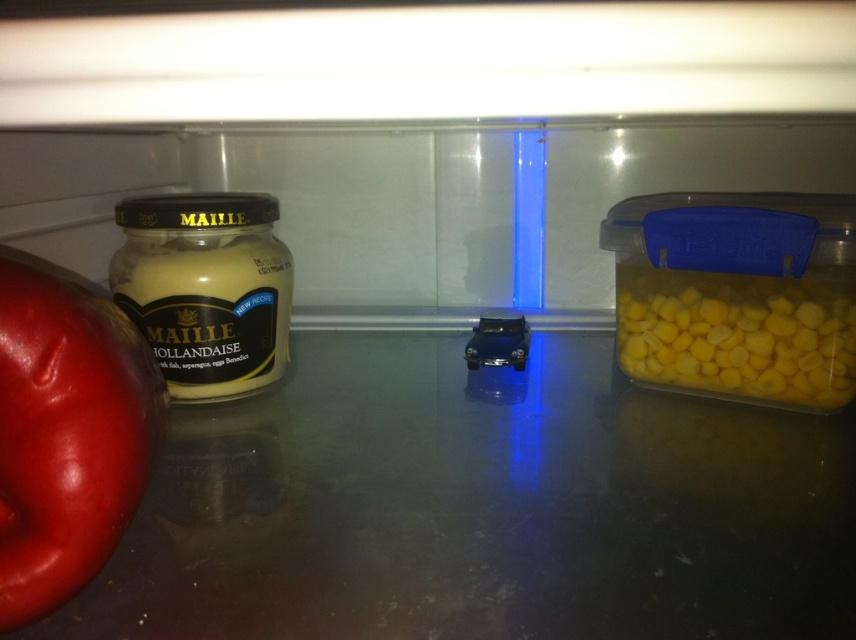
You are organizing the contents of the refrigerator and need to place a new item between the yellow matte corn at right and the matte yellow mustard at left. Is there enough vertical space between them to fit a 10 cm tall container?

The yellow matte corn at right is positioned under the matte yellow mustard at left, meaning there is vertical space between them. Since the container is only 10 cm tall, it should fit between them vertically.

You are organizing the contents of a refrigerator. You have a shiny red apple at left and a yellow matte corn at right. If you want to place a new item between them, where should you put it?

You should place the new item between the shiny red apple at left and the yellow matte corn at right, to the right of the shiny red apple at left and to the left of the yellow matte corn at right.

You are standing in front of the refrigerator and want to reach the point marked at coordinates [244,346]. Considering your arm can extend 60 centimeters, can you reach that point without moving closer to the refrigerator?

The point at coordinates [244,346] is 66.54 centimeters away from the viewer. Since your arm can only extend 60 centimeters, you cannot reach that point without moving closer to the refrigerator.